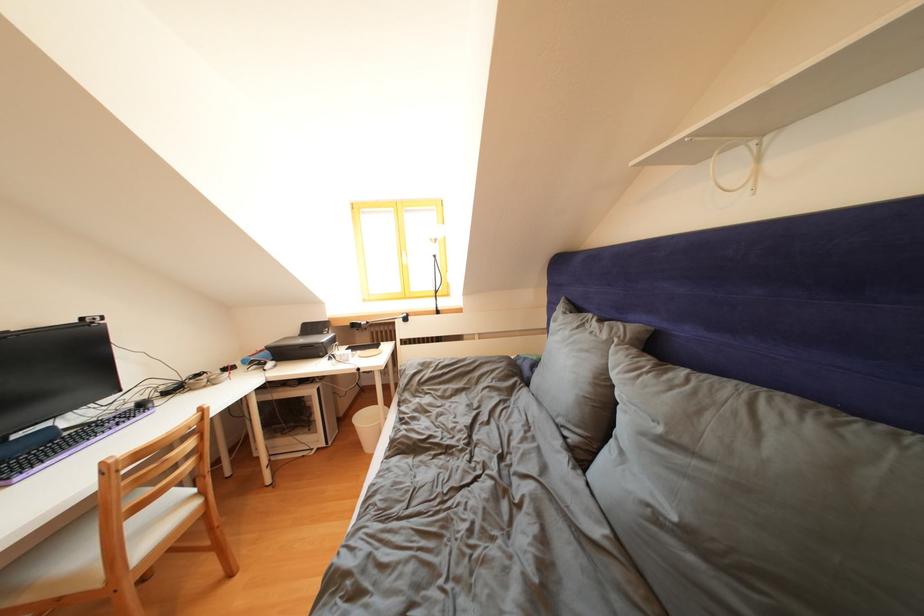
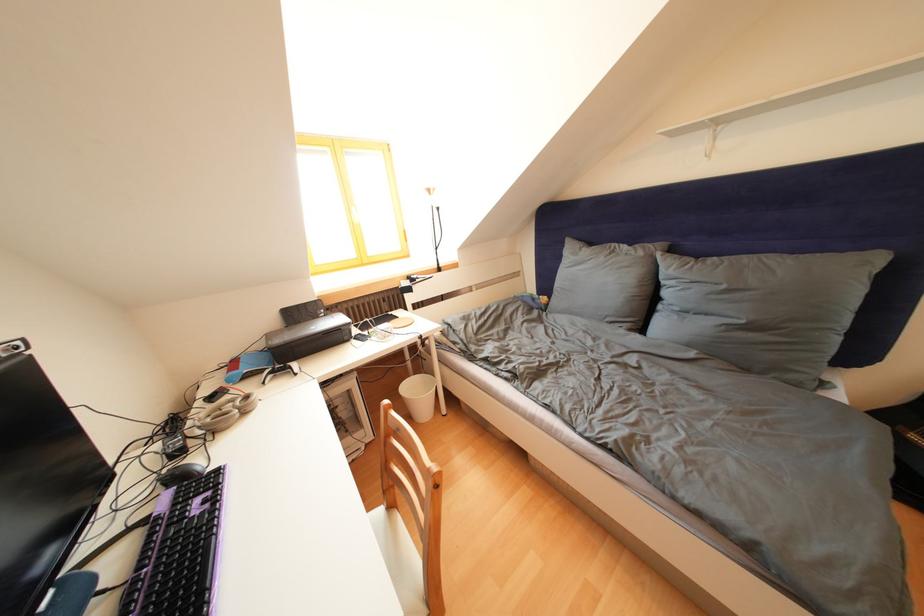
Locate, in the second image, the point that corresponds to (x=612, y=341) in the first image.

(649, 259)